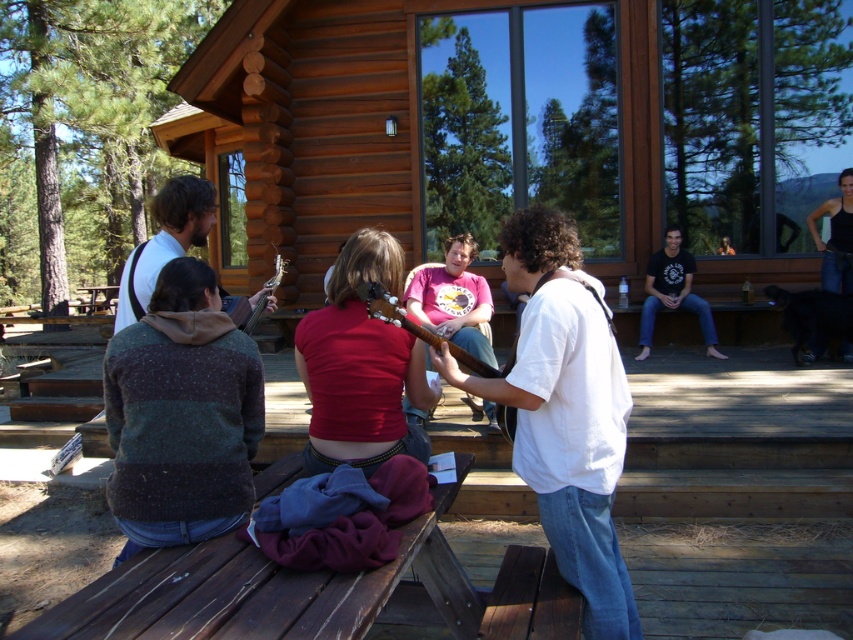
Question: Does matte red shirt at center have a larger size compared to wooden acoustic guitar at center?

Choices:
 (A) yes
 (B) no

Answer: (A)

Question: Does white cotton shirt at center have a smaller size compared to wooden acoustic guitar at center?

Choices:
 (A) no
 (B) yes

Answer: (A)

Question: Which point appears farthest from the camera in this image?

Choices:
 (A) (201, 500)
 (B) (722, 253)
 (C) (265, 301)
 (D) (831, 196)

Answer: (B)

Question: Which object is positioned closest to the white cotton shirt at center?

Choices:
 (A) wooden cabin at center
 (B) speckled wool sweater at lower left
 (C) matte white guitar at center

Answer: (B)

Question: Where is white cotton shirt at center located in relation to black tank top at upper right in the image?

Choices:
 (A) below
 (B) above

Answer: (A)

Question: Which of the following is the farthest from the observer?

Choices:
 (A) (328, 61)
 (B) (848, 355)
 (C) (635, 356)

Answer: (A)